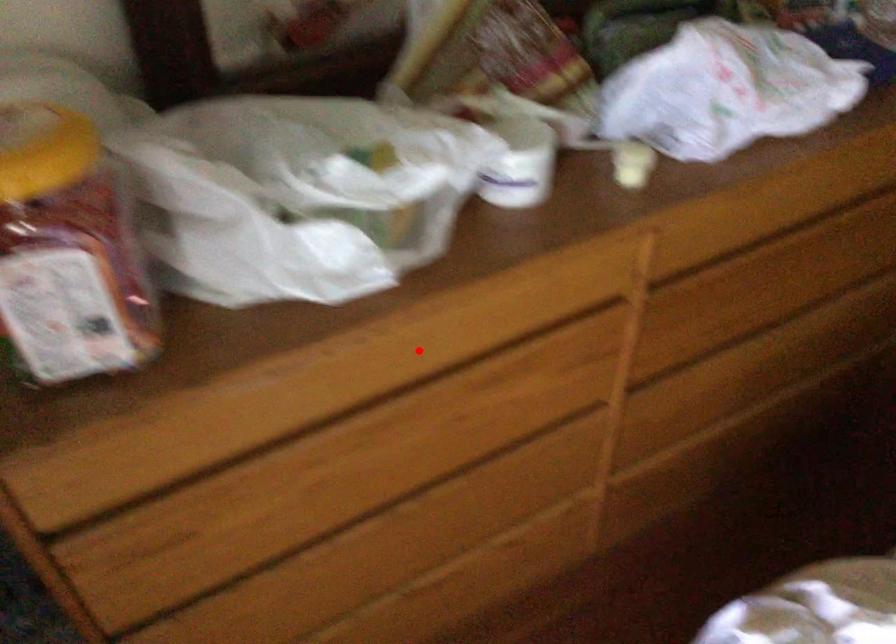
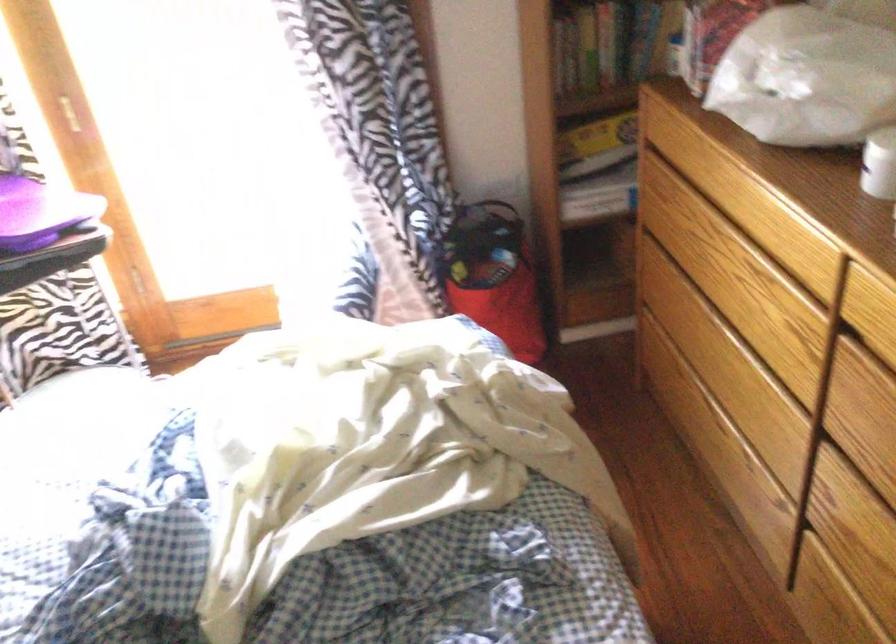
The point at the highlighted location is marked in the first image. Where is the corresponding point in the second image?

(734, 187)